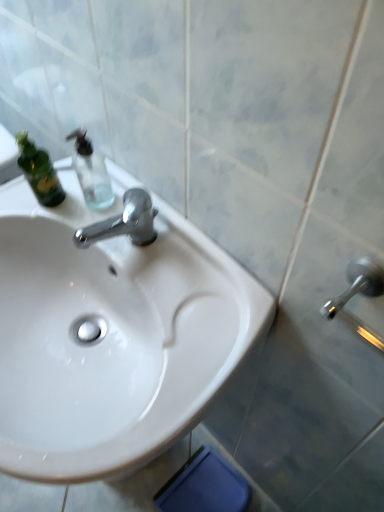
Question: Is white glossy sink at center beside transparent glass soap dispenser at upper left?

Choices:
 (A) yes
 (B) no

Answer: (B)

Question: Is white glossy sink at center positioned before transparent glass soap dispenser at upper left?

Choices:
 (A) yes
 (B) no

Answer: (A)

Question: Is white glossy sink at center facing away from transparent glass soap dispenser at upper left?

Choices:
 (A) yes
 (B) no

Answer: (B)

Question: Does white glossy sink at center have a smaller size compared to transparent glass soap dispenser at upper left?

Choices:
 (A) no
 (B) yes

Answer: (A)

Question: Is white glossy sink at center outside of transparent glass soap dispenser at upper left?

Choices:
 (A) yes
 (B) no

Answer: (A)

Question: Is white glossy sink at center further to camera compared to transparent glass soap dispenser at upper left?

Choices:
 (A) no
 (B) yes

Answer: (A)

Question: Does transparent glass soap dispenser at upper left have a lesser height compared to white glossy sink at center?

Choices:
 (A) no
 (B) yes

Answer: (B)

Question: Can you confirm if transparent glass soap dispenser at upper left is bigger than white glossy sink at center?

Choices:
 (A) yes
 (B) no

Answer: (B)

Question: Is transparent glass soap dispenser at upper left not within white glossy sink at center?

Choices:
 (A) no
 (B) yes

Answer: (B)

Question: From the image's perspective, would you say transparent glass soap dispenser at upper left is positioned over white glossy sink at center?

Choices:
 (A) yes
 (B) no

Answer: (A)

Question: Could you tell me if transparent glass soap dispenser at upper left is turned towards white glossy sink at center?

Choices:
 (A) no
 (B) yes

Answer: (A)

Question: Is transparent glass soap dispenser at upper left with white glossy sink at center?

Choices:
 (A) no
 (B) yes

Answer: (A)

Question: In terms of height, does white glossy sink at center look taller or shorter compared to transparent glass soap dispenser at upper left?

Choices:
 (A) tall
 (B) short

Answer: (A)